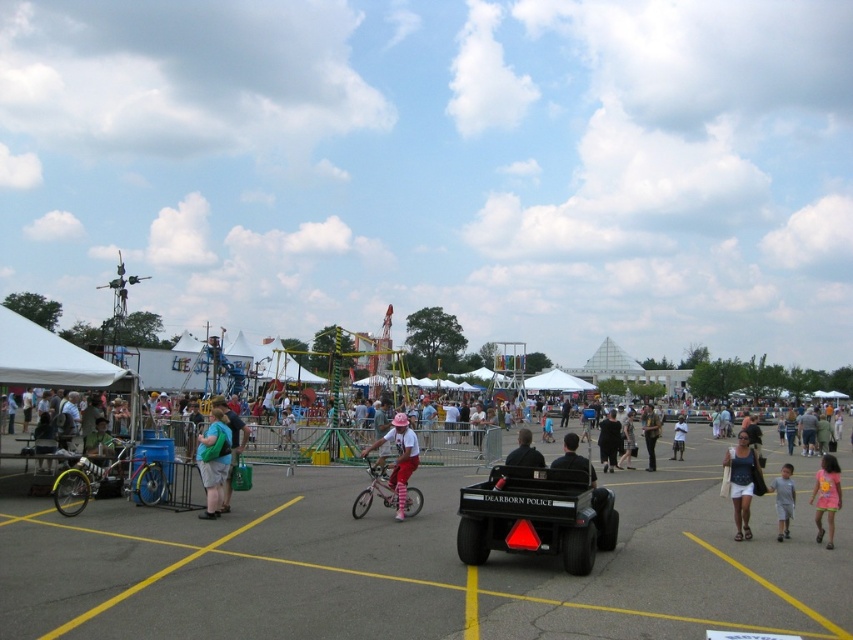
You are at the fair and want to take a photo of the black matte utility vehicle at center and the white cotton tank top at center. Which object should you zoom in more on to capture both in the frame?

You should zoom in more on the white cotton tank top at center because the black matte utility vehicle at center is smaller in size compared to the white cotton tank top at center, so adjusting focus on the larger object will help include both in the frame.